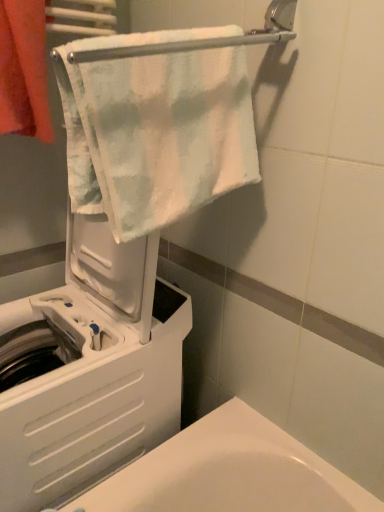
Question: Is orange cotton towel at upper left, marked as the second towel in a right-to-left arrangement, not within white soft towel at upper center, placed as the second towel when sorted from left to right?

Choices:
 (A) yes
 (B) no

Answer: (A)

Question: Does orange cotton towel at upper left, marked as the second towel in a right-to-left arrangement, have a greater height compared to white soft towel at upper center, placed as the second towel when sorted from left to right?

Choices:
 (A) yes
 (B) no

Answer: (B)

Question: Is orange cotton towel at upper left, positioned as the 1th towel in left-to-right order, placed right next to white soft towel at upper center, placed as the second towel when sorted from left to right?

Choices:
 (A) no
 (B) yes

Answer: (A)

Question: Considering the relative sizes of orange cotton towel at upper left, marked as the second towel in a right-to-left arrangement, and white soft towel at upper center, placed as the second towel when sorted from left to right, in the image provided, is orange cotton towel at upper left, marked as the second towel in a right-to-left arrangement, bigger than white soft towel at upper center, placed as the second towel when sorted from left to right,?

Choices:
 (A) yes
 (B) no

Answer: (B)

Question: Is orange cotton towel at upper left, marked as the second towel in a right-to-left arrangement, thinner than white soft towel at upper center, placed as the second towel when sorted from left to right?

Choices:
 (A) no
 (B) yes

Answer: (B)

Question: From a real-world perspective, is orange cotton towel at upper left, marked as the second towel in a right-to-left arrangement, over white soft towel at upper center, which is the first towel from right to left?

Choices:
 (A) yes
 (B) no

Answer: (A)

Question: From the image's perspective, does orange cotton towel at upper left, marked as the second towel in a right-to-left arrangement, appear lower than white plastic washing machine at left?

Choices:
 (A) no
 (B) yes

Answer: (A)

Question: Can you confirm if orange cotton towel at upper left, positioned as the 1th towel in left-to-right order, is bigger than white plastic washing machine at left?

Choices:
 (A) yes
 (B) no

Answer: (B)

Question: Does orange cotton towel at upper left, positioned as the 1th towel in left-to-right order, have a greater height compared to white plastic washing machine at left?

Choices:
 (A) no
 (B) yes

Answer: (A)

Question: Is orange cotton towel at upper left, positioned as the 1th towel in left-to-right order, in front of white plastic washing machine at left?

Choices:
 (A) yes
 (B) no

Answer: (B)

Question: Could you tell me if orange cotton towel at upper left, marked as the second towel in a right-to-left arrangement, is turned towards white plastic washing machine at left?

Choices:
 (A) yes
 (B) no

Answer: (B)

Question: Is white plastic washing machine at left surrounded by orange cotton towel at upper left, marked as the second towel in a right-to-left arrangement?

Choices:
 (A) yes
 (B) no

Answer: (B)

Question: Considering the relative sizes of white soft towel at upper center, placed as the second towel when sorted from left to right, and white plastic washing machine at left in the image provided, is white soft towel at upper center, placed as the second towel when sorted from left to right, thinner than white plastic washing machine at left?

Choices:
 (A) no
 (B) yes

Answer: (B)